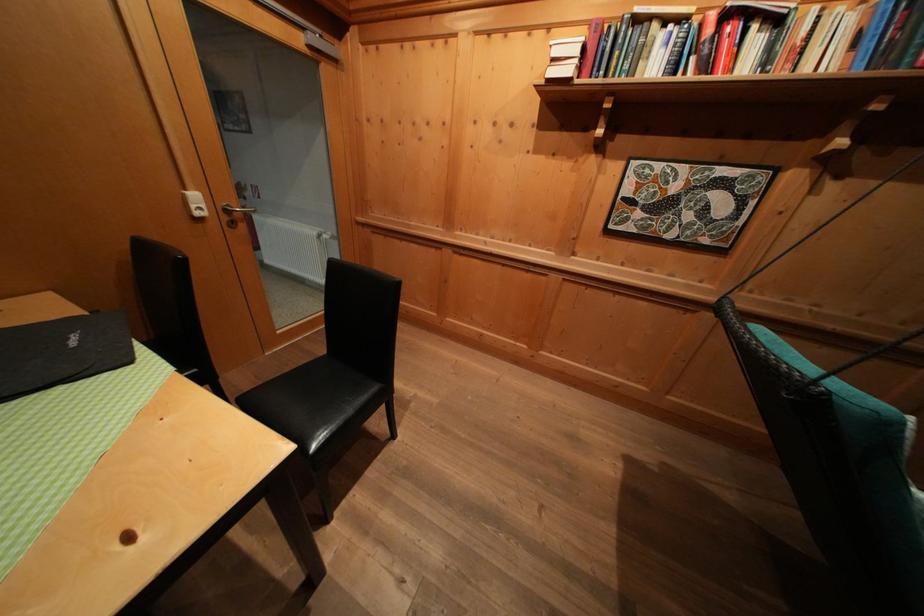
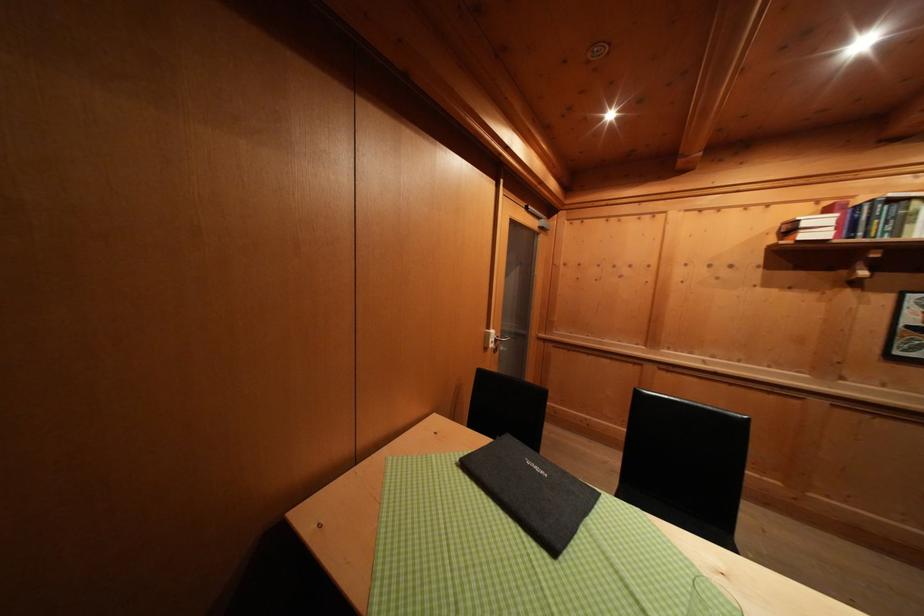
Question: In a continuous first-person perspective shot, in which direction is the camera moving?

Choices:
 (A) Left
 (B) Right
 (C) Forward
 (D) Backward

Answer: (A)